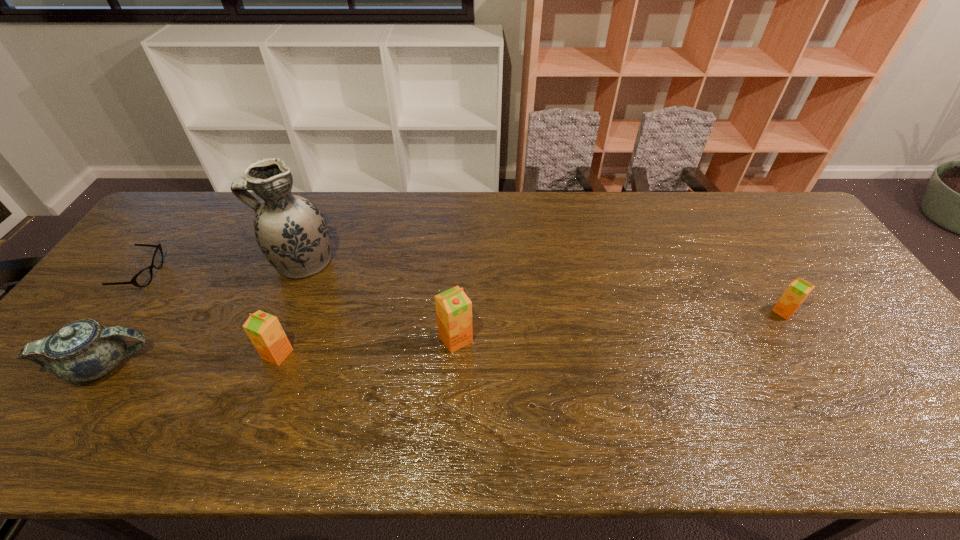
The image size is (960, 540). I want to click on vacant space located on the back of the fourth nearest object, so click(x=742, y=245).

Find the location of a particular element. free space located 0.120m on the front-facing side of the spectacles is located at coordinates (201, 275).

Find the location of a particular element. Image resolution: width=960 pixels, height=540 pixels. free space located 0.390m from the spout of the chinaware is located at coordinates (308, 365).

Where is `vacant space located 0.330m with the handle on the side of the vase`? The width and height of the screenshot is (960, 540). vacant space located 0.330m with the handle on the side of the vase is located at coordinates (156, 262).

The width and height of the screenshot is (960, 540). Find the location of `free space located 0.210m with the handle on the side of the vase`. free space located 0.210m with the handle on the side of the vase is located at coordinates (197, 262).

This screenshot has width=960, height=540. I want to click on vacant space located 0.140m with the handle on the side of the vase, so click(x=220, y=262).

Identify the location of object that is positioned at the near edge. This screenshot has width=960, height=540. (84, 350).

You are a GUI agent. You are given a task and a screenshot of the screen. Output one action in this format:
    pyautogui.click(x=<x>, y=<y>)
    Task: Click on the spectacles that is at the left edge
    Image resolution: width=960 pixels, height=540 pixels.
    Given the screenshot: What is the action you would take?
    pyautogui.click(x=143, y=278)

This screenshot has height=540, width=960. I want to click on chinaware located at the left edge, so click(x=84, y=350).

Find the location of `object located in the near left corner section of the desktop`. object located in the near left corner section of the desktop is located at coordinates (84, 350).